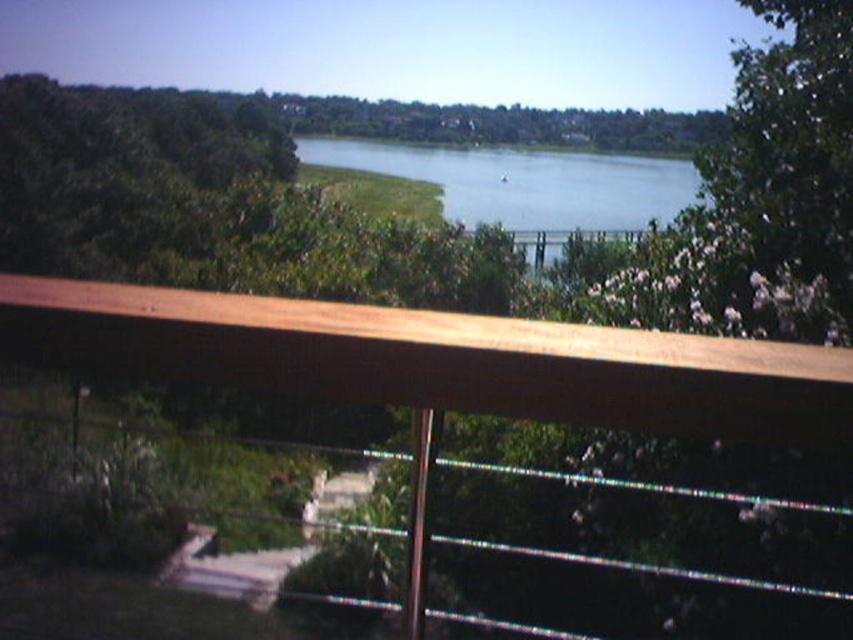
Can you confirm if wooden railing at upper center is thinner than blue water at center?

Yes.

Is wooden railing at upper center smaller than blue water at center?

Indeed, wooden railing at upper center has a smaller size compared to blue water at center.

At what (x,y) coordinates should I click in order to perform the action: click on wooden railing at upper center. Please return your answer as a coordinate pair (x, y). The height and width of the screenshot is (640, 853). Looking at the image, I should click on (434, 358).